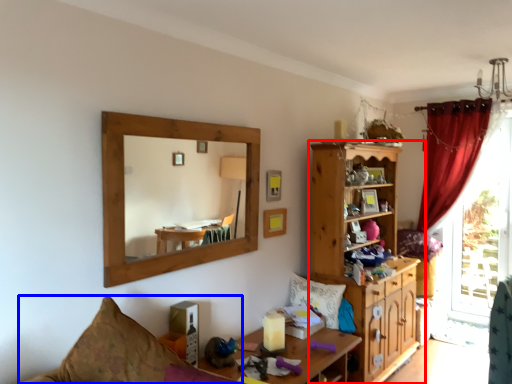
Question: Which object is closer to the camera taking this photo, cabinetry (highlighted by a red box) or couch (highlighted by a blue box)?

Choices:
 (A) cabinetry
 (B) couch

Answer: (B)